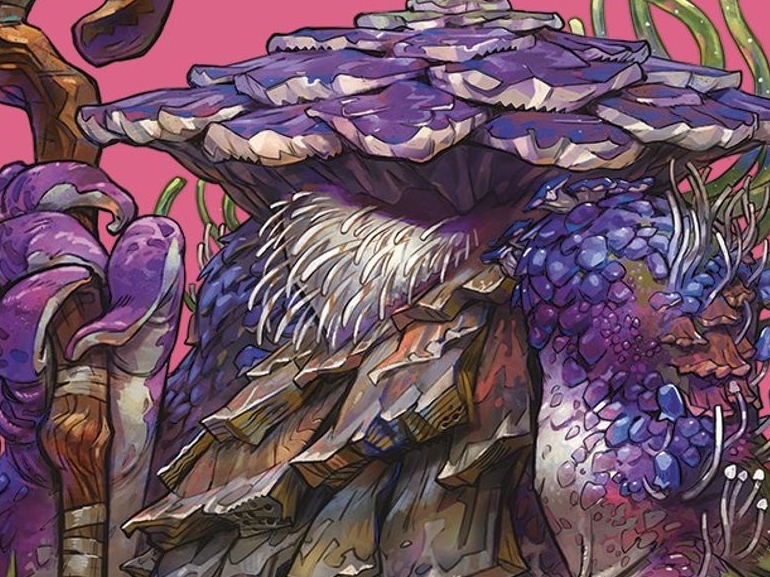
Locate an element on the screen. Image resolution: width=770 pixels, height=577 pixels. green plates is located at coordinates (417, 18), (479, 16), (454, 5).